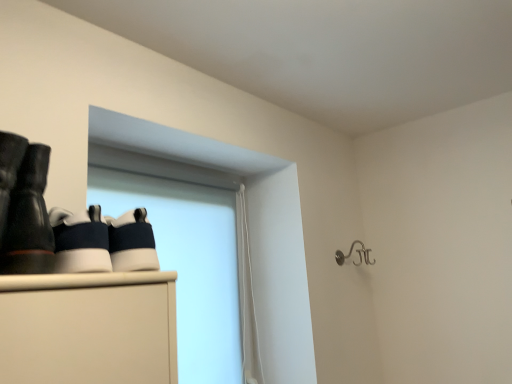
At what (x,y) coordinates should I click in order to perform the action: click on silver metallic hook at upper right. Please return your answer as a coordinate pair (x, y). Looking at the image, I should click on (351, 254).

This screenshot has width=512, height=384. Describe the element at coordinates (29, 219) in the screenshot. I see `matte black boots at left` at that location.

Identify the location of matte black boots at left. (29, 219).

What are the coordinates of `silver metallic hook at upper right` in the screenshot? It's located at (351, 254).

From the picture: From a real-world perspective, relative to silver metallic hook at upper right, is white matte window screen at upper left vertically above or below?

In terms of real-world spatial position, white matte window screen at upper left is below silver metallic hook at upper right.

Considering the sizes of white matte window screen at upper left and silver metallic hook at upper right in the image, is white matte window screen at upper left taller or shorter than silver metallic hook at upper right?

Clearly, white matte window screen at upper left is taller compared to silver metallic hook at upper right.

Which of these two, white matte window screen at upper left or silver metallic hook at upper right, is bigger?

white matte window screen at upper left.

Is white matte window screen at upper left facing away from silver metallic hook at upper right?

white matte window screen at upper left is not turned away from silver metallic hook at upper right.

Considering the relative sizes of white matte window screen at upper left and matte black boots at left in the image provided, is white matte window screen at upper left shorter than matte black boots at left?

No.

How many degrees apart are the facing directions of white matte window screen at upper left and matte black boots at left?

The facing directions of white matte window screen at upper left and matte black boots at left are 0.353 degrees apart.

Considering the positions of point (184, 221) and point (24, 271), is point (184, 221) closer or farther from the camera than point (24, 271)?

Point (184, 221) is farther from the camera than point (24, 271).

Can you confirm if white matte window screen at upper left is positioned to the right of matte black boots at left?

Yes.

Is silver metallic hook at upper right taller than matte black boots at left?

No, silver metallic hook at upper right is not taller than matte black boots at left.

The image size is (512, 384). Find the location of `shower below the matte black boots at left (from the image's perspective)`. shower below the matte black boots at left (from the image's perspective) is located at coordinates (351, 254).

Consider the image. From a real-world perspective, is silver metallic hook at upper right physically located above or below matte black boots at left?

In terms of real-world spatial position, silver metallic hook at upper right is below matte black boots at left.

Find the location of a particular element. Image resolution: width=512 pixels, height=384 pixels. footwear above the silver metallic hook at upper right (from a real-world perspective) is located at coordinates (29, 219).

Which is more to the left, matte black boots at left or silver metallic hook at upper right?

matte black boots at left.

Could you tell me if matte black boots at left is turned towards silver metallic hook at upper right?

No, matte black boots at left is not turned towards silver metallic hook at upper right.

Is matte black boots at left situated inside silver metallic hook at upper right or outside?

The correct answer is: outside.

Which of these two, matte black boots at left or white matte window screen at upper left, is wider?

matte black boots at left is wider.

Is there a large distance between matte black boots at left and white matte window screen at upper left?

No, matte black boots at left is not far from white matte window screen at upper left.

Considering the positions of objects matte black boots at left and white matte window screen at upper left in the image provided, who is more to the left, matte black boots at left or white matte window screen at upper left?

Positioned to the left is matte black boots at left.

Measure the distance between matte black boots at left and white matte window screen at upper left.

matte black boots at left is 35.63 inches from white matte window screen at upper left.

Could you tell me if silver metallic hook at upper right is turned towards white matte window screen at upper left?

No.

In terms of size, does silver metallic hook at upper right appear bigger or smaller than white matte window screen at upper left?

In the image, silver metallic hook at upper right appears to be smaller than white matte window screen at upper left.

Considering the sizes of objects silver metallic hook at upper right and white matte window screen at upper left in the image provided, who is taller, silver metallic hook at upper right or white matte window screen at upper left?

white matte window screen at upper left.

In terms of width, does silver metallic hook at upper right look wider or thinner when compared to white matte window screen at upper left?

Considering their sizes, silver metallic hook at upper right looks broader than white matte window screen at upper left.

Find the location of a particular element. This screenshot has width=512, height=384. window screen in front of the silver metallic hook at upper right is located at coordinates (188, 263).

At what (x,y) coordinates should I click in order to perform the action: click on window screen directly beneath the matte black boots at left (from a real-world perspective). Please return your answer as a coordinate pair (x, y). Looking at the image, I should click on (188, 263).

Based on their spatial positions, is matte black boots at left or silver metallic hook at upper right closer to white matte window screen at upper left?

The object closer to white matte window screen at upper left is silver metallic hook at upper right.

Which object lies nearer to the anchor point matte black boots at left, silver metallic hook at upper right or white matte window screen at upper left?

white matte window screen at upper left lies closer to matte black boots at left than the other object.

Based on their spatial positions, is white matte window screen at upper left or silver metallic hook at upper right closer to matte black boots at left?

white matte window screen at upper left.

Considering their positions, is matte black boots at left positioned further to silver metallic hook at upper right than white matte window screen at upper left?

→ Among the two, matte black boots at left is located further to silver metallic hook at upper right.

When comparing their distances from white matte window screen at upper left, does silver metallic hook at upper right or matte black boots at left seem further?

Based on the image, matte black boots at left appears to be further to white matte window screen at upper left.

Looking at the image, which one is located further to silver metallic hook at upper right, white matte window screen at upper left or matte black boots at left?

matte black boots at left is positioned further to the anchor silver metallic hook at upper right.

This screenshot has width=512, height=384. Find the location of `window screen between matte black boots at left and silver metallic hook at upper right along the z-axis`. window screen between matte black boots at left and silver metallic hook at upper right along the z-axis is located at coordinates (x=188, y=263).